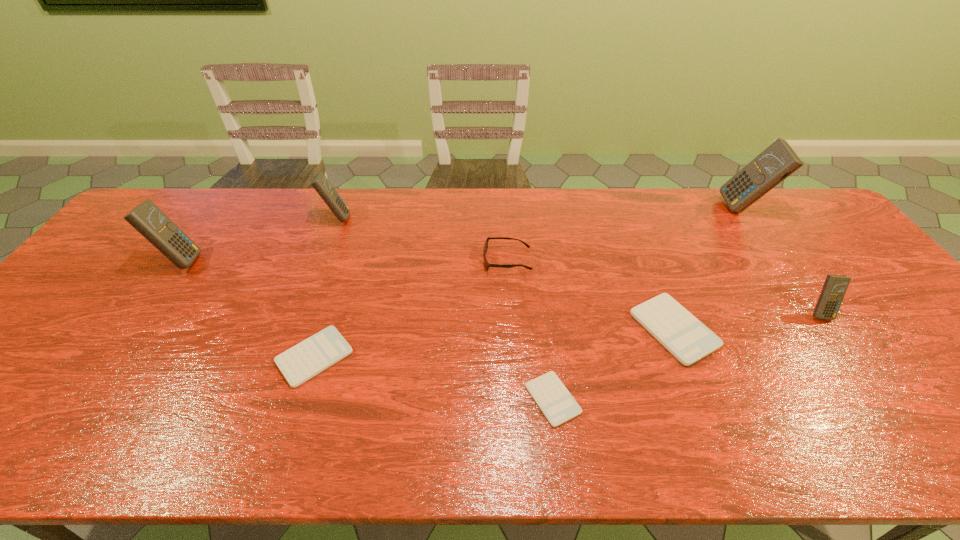
Identify which white calculator is located as the second nearest to the second white calculator from left to right. Please provide its 2D coordinates. Your answer should be formatted as a tuple, i.e. [(x, y)], where the tuple contains the x and y coordinates of a point satisfying the conditions above.

[(310, 357)]

In order to click on vacant region that satisfies the following two spatial constraints: 1. on the back side of the seventh tallest object; 2. on the front-facing side of the second blue calculator from left to right in this screenshot , I will do `click(359, 218)`.

The image size is (960, 540). I want to click on blank space that satisfies the following two spatial constraints: 1. on the front-facing side of the fifth tallest calculator; 2. on the left side of the second tallest object, so click(133, 329).

Find the location of `free spot that satisfies the following two spatial constraints: 1. on the front-facing side of the second nearest blue calculator; 2. on the left side of the sixth object from left to right`. free spot that satisfies the following two spatial constraints: 1. on the front-facing side of the second nearest blue calculator; 2. on the left side of the sixth object from left to right is located at coordinates (133, 329).

Locate an element on the screen. This screenshot has width=960, height=540. free location that satisfies the following two spatial constraints: 1. on the back side of the leftmost white calculator; 2. on the front-facing side of the third farthest blue calculator is located at coordinates (345, 261).